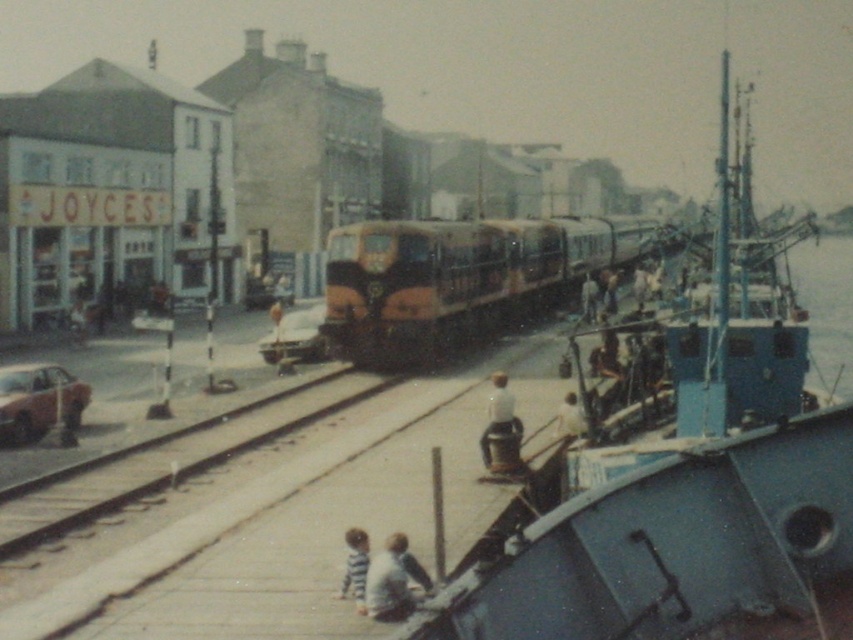
Question: Which of the following is the closest to the observer?

Choices:
 (A) striped fabric child at lower center
 (B) white matte shirt at center
 (C) brown metallic train at center

Answer: (A)

Question: Observing the image, what is the correct spatial positioning of blue metallic boat at center in reference to light blue fabric shirt at lower center?

Choices:
 (A) below
 (B) above

Answer: (B)

Question: Is brown metallic train at center positioned at the back of white matte shirt at center?

Choices:
 (A) yes
 (B) no

Answer: (A)

Question: Which of the following is the closest to the observer?

Choices:
 (A) (486, 426)
 (B) (405, 570)
 (C) (440, 264)

Answer: (B)

Question: Which object appears farthest from the camera in this image?

Choices:
 (A) striped fabric child at lower center
 (B) smooth concrete train track at center
 (C) blue metallic boat at center
 (D) white fabric shirt at lower center

Answer: (D)

Question: Is light blue fabric shirt at lower center positioned behind striped fabric child at lower center?

Choices:
 (A) no
 (B) yes

Answer: (A)